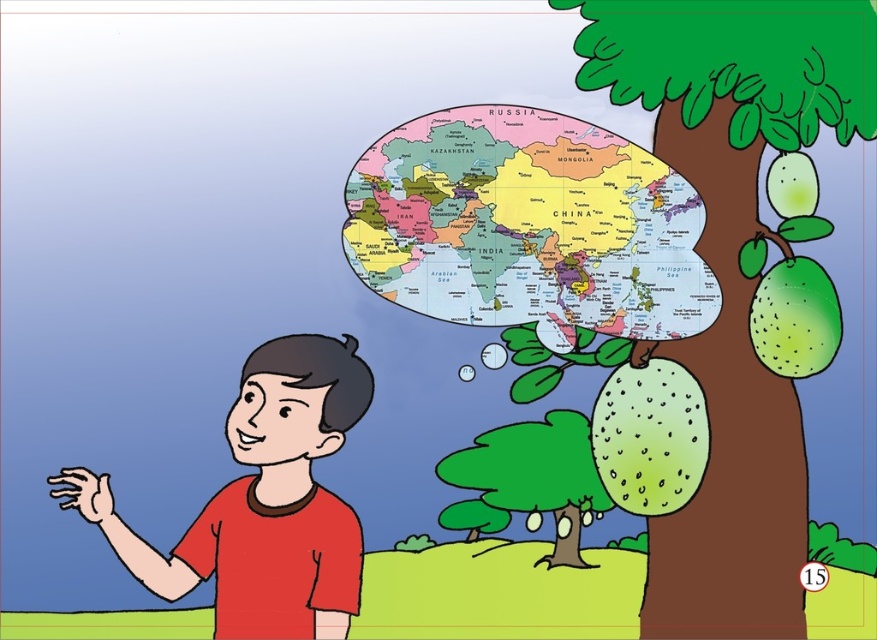
You are a drone operator trying to capture a photo of the green leafy tree at upper right and the matte red shirt at left. The camera has a 18 inch focus range. Can you fit both objects in the frame without moving the drone?

The distance between the green leafy tree at upper right and the matte red shirt at left is 17.98 inches, which is within the camera focus range of 18 inches. Therefore, both objects can be captured in the frame without moving the drone.

In the scene shown: The boy is holding a colorful paper map at upper center and standing near a green matte tree at center. Which object is wider?

The colorful paper map at upper center is wider than the green matte tree at center.

You are a character in the scene and want to know which object takes up more area in your view. Which one is larger in size between the colorful paper map at upper center and the matte red shirt at left?

The matte red shirt at left occupies more space than the colorful paper map at upper center according to the description.